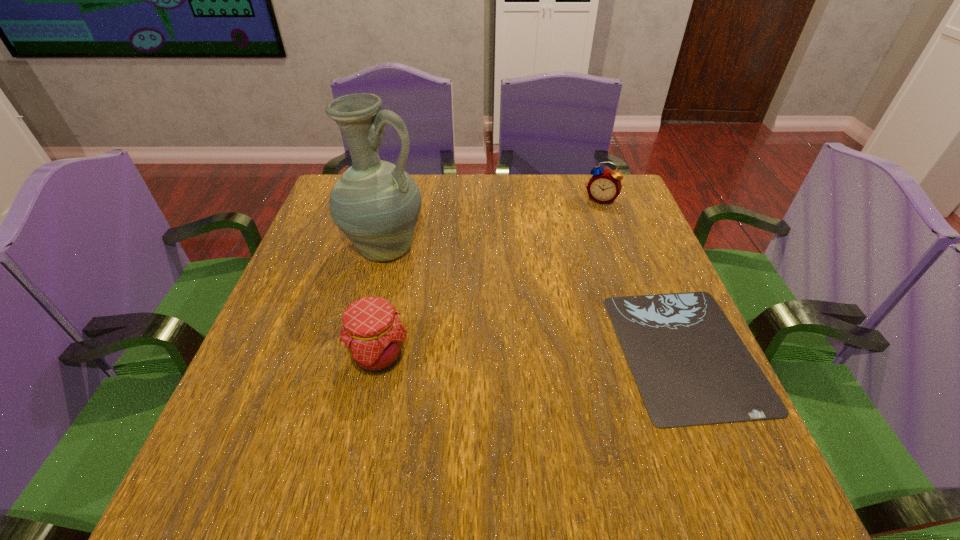
This screenshot has width=960, height=540. In order to click on free spot on the desktop that is between the jam and the shortest object and is positioned on the handle side of the tallest object in this screenshot , I will do (x=573, y=353).

Identify the location of vacant space on the desktop that is between the jam and the mousepad and is positioned on the front-facing side of the farthest object. The height and width of the screenshot is (540, 960). (545, 354).